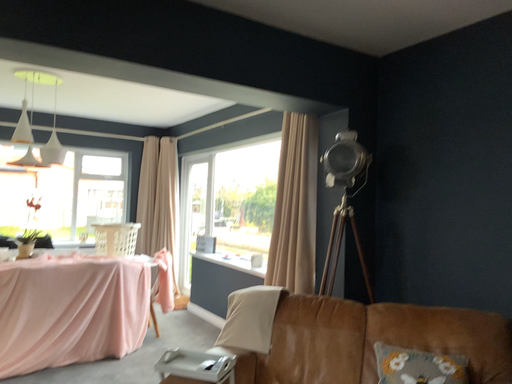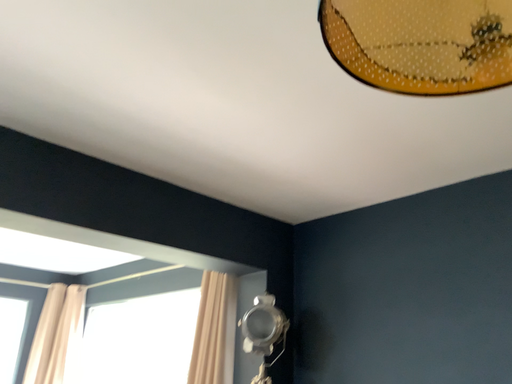
Question: How did the camera likely rotate when shooting the video?

Choices:
 (A) rotated upward
 (B) rotated downward

Answer: (A)